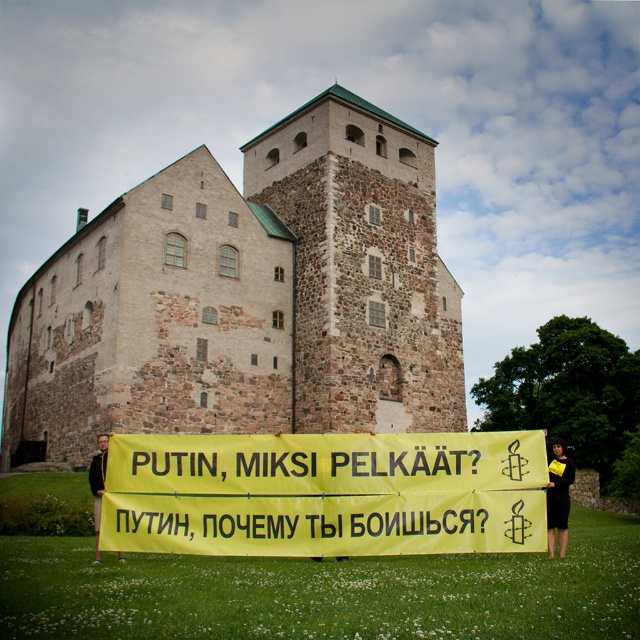
Question: Based on their relative distances, which object is farther from the black fabric at lower right?

Choices:
 (A) yellow/yellow paper at center
 (B) dark brown leather jacket at center

Answer: (B)

Question: Can you confirm if stone brick castle at center is thinner than dark brown leather jacket at center?

Choices:
 (A) yes
 (B) no

Answer: (B)

Question: Is stone brick castle at center below black fabric at lower right?

Choices:
 (A) no
 (B) yes

Answer: (A)

Question: Is stone brick castle at center above dark brown leather jacket at center?

Choices:
 (A) yes
 (B) no

Answer: (A)

Question: Based on their relative distances, which object is farther from the stone brick castle at center?

Choices:
 (A) black fabric at lower right
 (B) dark brown leather jacket at center
 (C) yellow/yellow paper at center

Answer: (A)

Question: Which object is farther from the camera taking this photo?

Choices:
 (A) black fabric at lower right
 (B) dark brown leather jacket at center
 (C) yellow/yellow paper at center
 (D) stone brick castle at center

Answer: (D)